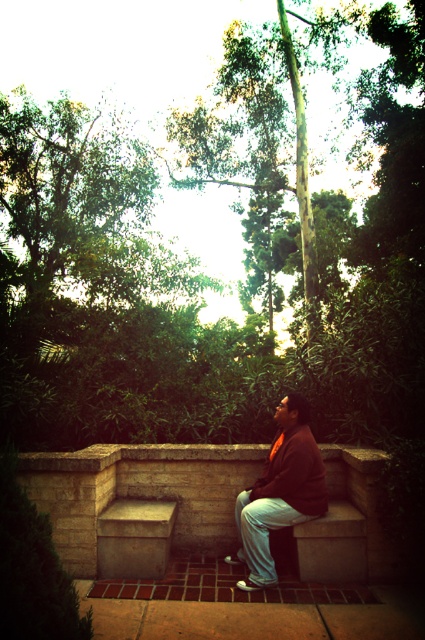
You are a person sitting on the stone bench at center and want to reach the matte brown jacket at center without getting up. Can you do it?

→ The stone bench at center is 29.93 inches away from matte brown jacket at center, so yes, you can reach the matte brown jacket at center while sitting on the stone bench at center as the distance is within typical arm reach.